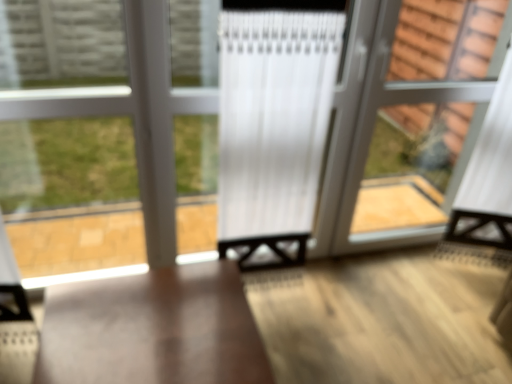
The height and width of the screenshot is (384, 512). I want to click on free location above matte wood table at center (from a real-world perspective), so click(142, 335).